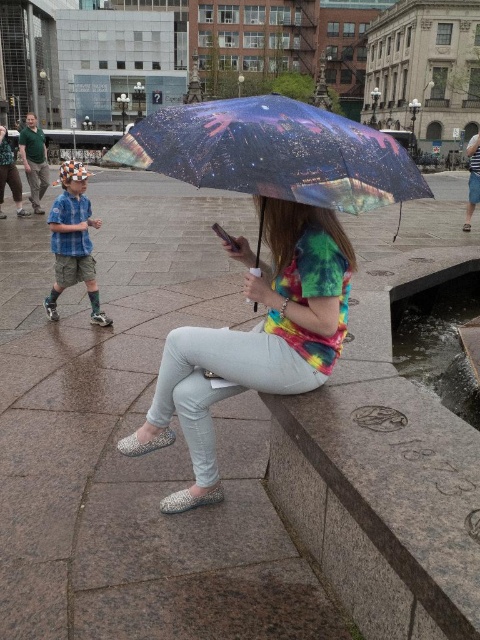
Does rainbow tie-dye shirt at center have a greater height compared to transparent printed umbrella at center?

Incorrect, rainbow tie-dye shirt at center's height is not larger of transparent printed umbrella at center's.

Between point (228, 388) and point (324, 170), which one is positioned in front?

Point (324, 170) is in front.

This screenshot has height=640, width=480. In order to click on rainbow tie-dye shirt at center in this screenshot , I will do `click(254, 340)`.

Who is higher up, transparent printed umbrella at center or matte blue shirt at left?

transparent printed umbrella at center is higher up.

Is point (313, 113) in front of point (87, 280)?

Yes, point (313, 113) is closer to viewer.

In order to click on transparent printed umbrella at center in this screenshot , I will do 275,154.

Does rainbow tie-dye shirt at center have a lesser height compared to matte blue shirt at left?

Correct, rainbow tie-dye shirt at center is not as tall as matte blue shirt at left.

The height and width of the screenshot is (640, 480). In order to click on rainbow tie-dye shirt at center in this screenshot , I will do `click(254, 340)`.

Measure the distance between point (323, 241) and camera.

Point (323, 241) and camera are 2.45 meters apart.

At what (x,y) coordinates should I click in order to perform the action: click on rainbow tie-dye shirt at center. Please return your answer as a coordinate pair (x, y). The image size is (480, 640). Looking at the image, I should click on (254, 340).